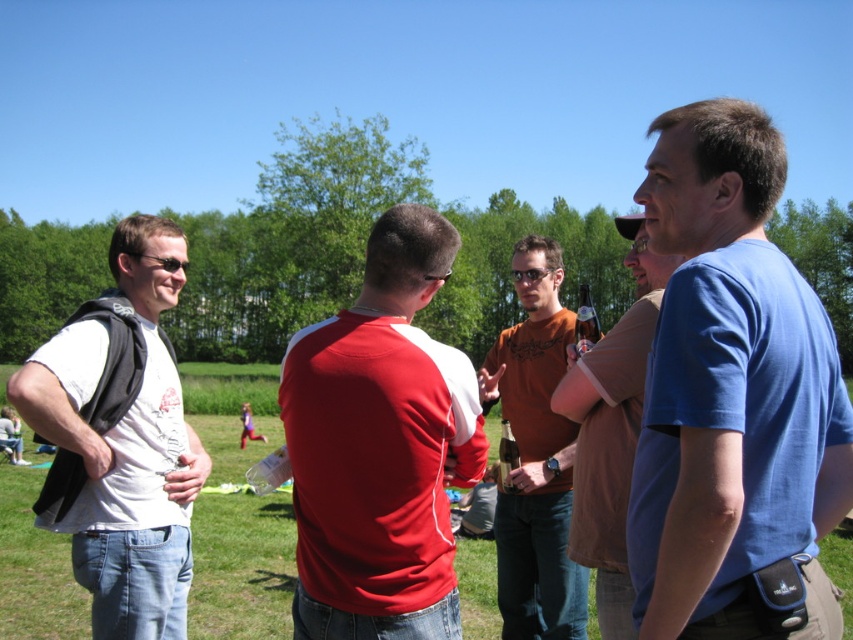
You are standing in the park and want to greet the person wearing the blue cotton shirt at right. Which direction should you walk to approach them first without going around the matte red shirt at center?

Since the blue cotton shirt at right is in front of the matte red shirt at center, you can walk directly towards the blue cotton shirt at right without needing to go around the matte red shirt at center.

You are standing in the park and see two points marked in the image. Which point, point (479, 428) or point (537, 529), is closer to you?

Point (479, 428) is closer to the viewer than point (537, 529).